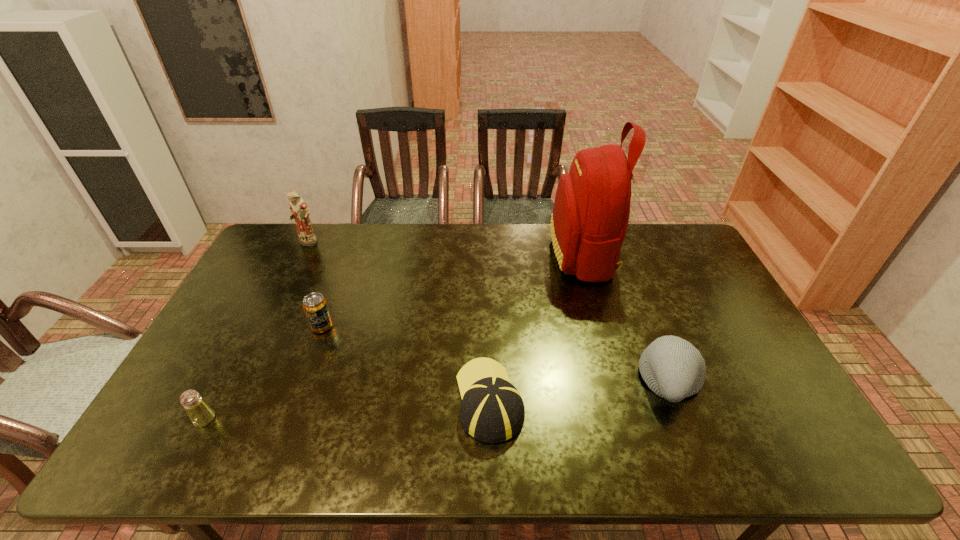
Locate an element on the screen. This screenshot has height=540, width=960. the tallest object is located at coordinates (591, 210).

At what (x,y) coordinates should I click in order to perform the action: click on figurine. Please return your answer as a coordinate pair (x, y). The image size is (960, 540). Looking at the image, I should click on (x=299, y=210).

Find the location of a particular element. beanie is located at coordinates (672, 367).

Where is `the third farthest object`? the third farthest object is located at coordinates (315, 306).

Identify the location of the fourth object from right to left. (315, 306).

This screenshot has height=540, width=960. What are the coordinates of `the fourth object from left to right` in the screenshot? It's located at (492, 411).

You are a GUI agent. You are given a task and a screenshot of the screen. Output one action in this format:
    pyautogui.click(x=<x>, y=<y>)
    Task: Click on the saltshaker
    The image size is (960, 540).
    Given the screenshot: What is the action you would take?
    pyautogui.click(x=200, y=413)

You are a GUI agent. You are given a task and a screenshot of the screen. Output one action in this format:
    pyautogui.click(x=<x>, y=<y>)
    Task: Click on the free location located 0.360m on the front-facing side of the tallest object
    This screenshot has width=960, height=540.
    Given the screenshot: What is the action you would take?
    pyautogui.click(x=449, y=254)

You are a GUI agent. You are given a task and a screenshot of the screen. Output one action in this format:
    pyautogui.click(x=<x>, y=<y>)
    Task: Click on the vacant space situated on the front-facing side of the tallest object
    
    Given the screenshot: What is the action you would take?
    pyautogui.click(x=441, y=254)

Locate an element on the screen. The width and height of the screenshot is (960, 540). free location located on the front-facing side of the tallest object is located at coordinates (534, 254).